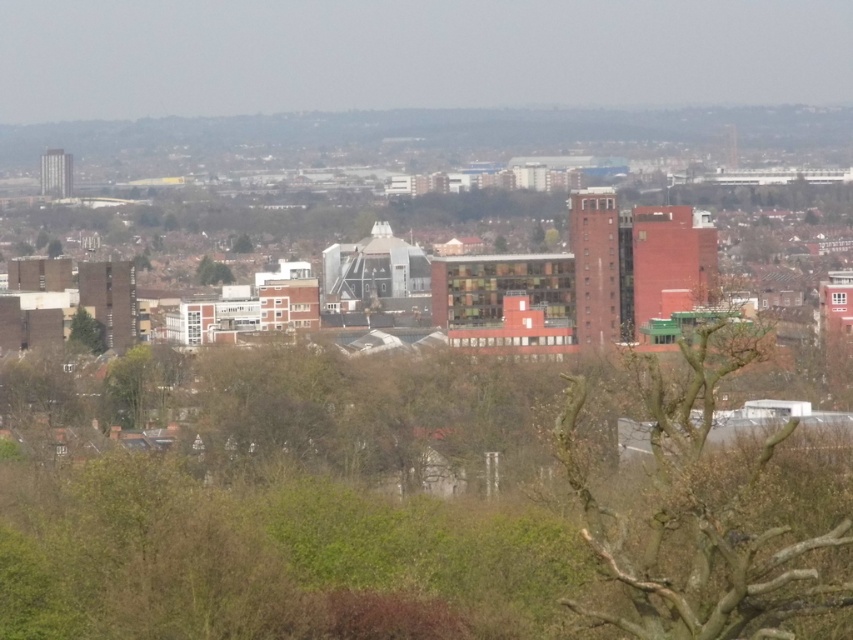
Is green leafy tree at lower left taller than green leafy tree at upper center?

Correct, green leafy tree at lower left is much taller as green leafy tree at upper center.

This screenshot has width=853, height=640. Describe the element at coordinates (86, 332) in the screenshot. I see `green leafy tree at lower left` at that location.

Image resolution: width=853 pixels, height=640 pixels. I want to click on green leafy tree at lower left, so click(86, 332).

Who is positioned more to the left, bare branches at center or green leafy tree at upper center?

Positioned to the left is green leafy tree at upper center.

Between point (717, 518) and point (218, 276), which one is positioned in front?

Point (717, 518) is in front.

Find the location of a particular element. bare branches at center is located at coordinates (699, 513).

Between bare branches at center and green leafy tree at lower left, which one has less height?

green leafy tree at lower left is shorter.

Between bare branches at center and green leafy tree at lower left, which one has more height?

bare branches at center is taller.

You are a GUI agent. You are given a task and a screenshot of the screen. Output one action in this format:
    pyautogui.click(x=<x>, y=<y>)
    Task: Click on the bare branches at center
    Image resolution: width=853 pixels, height=640 pixels.
    Given the screenshot: What is the action you would take?
    pyautogui.click(x=699, y=513)